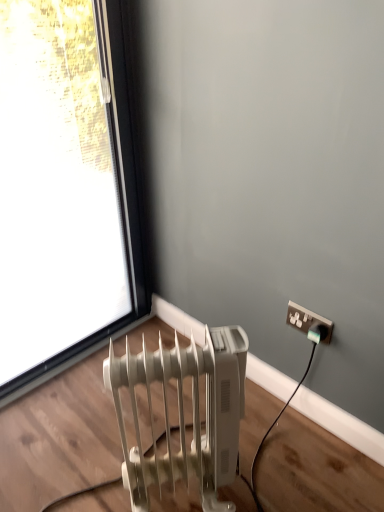
Question: From the image's perspective, is white plastic power plugs and sockets at upper right located above or below transparent glass window at upper left?

Choices:
 (A) below
 (B) above

Answer: (A)

Question: Based on their sizes in the image, would you say white plastic power plugs and sockets at upper right is bigger or smaller than transparent glass window at upper left?

Choices:
 (A) big
 (B) small

Answer: (B)

Question: Which of these objects is positioned closest to the white plastic radiator at lower left?

Choices:
 (A) white plastic power plugs and sockets at upper right
 (B) transparent glass window at upper left

Answer: (A)

Question: Which object is positioned closest to the white plastic power plugs and sockets at upper right?

Choices:
 (A) transparent glass window at upper left
 (B) white plastic radiator at lower left

Answer: (B)